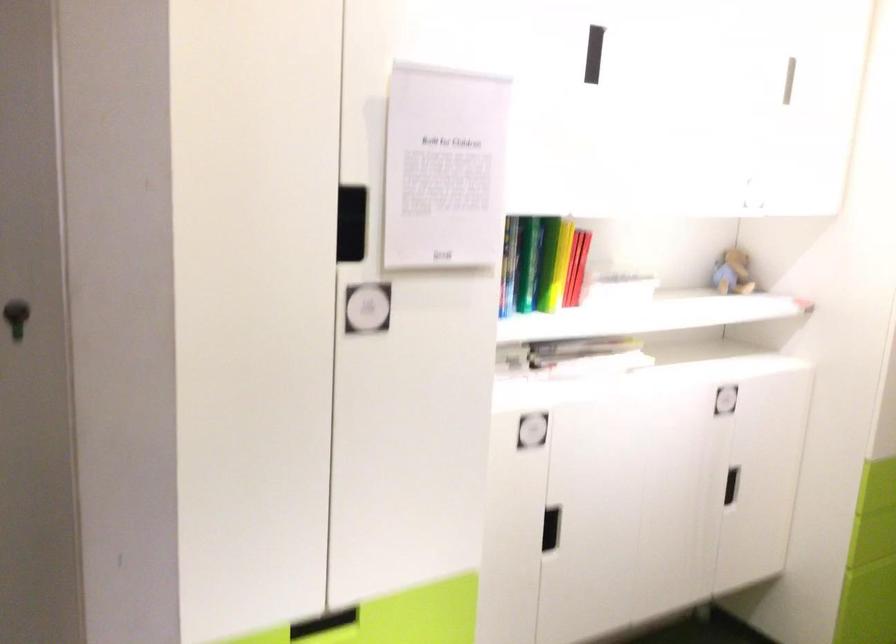
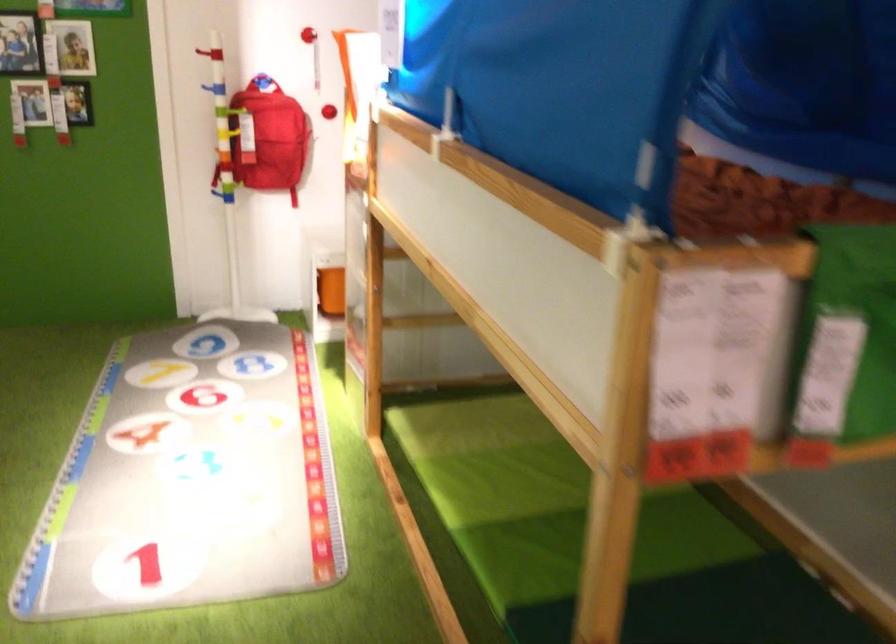
Based on the continuous images, in which direction is the camera rotating?

The camera's rotation is toward right-down.